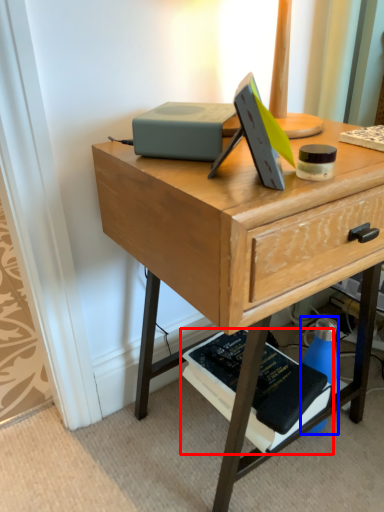
Question: Which point is further to the camera, paperback book (highlighted by a red box) or bottle (highlighted by a blue box)?

Choices:
 (A) paperback book
 (B) bottle

Answer: (B)